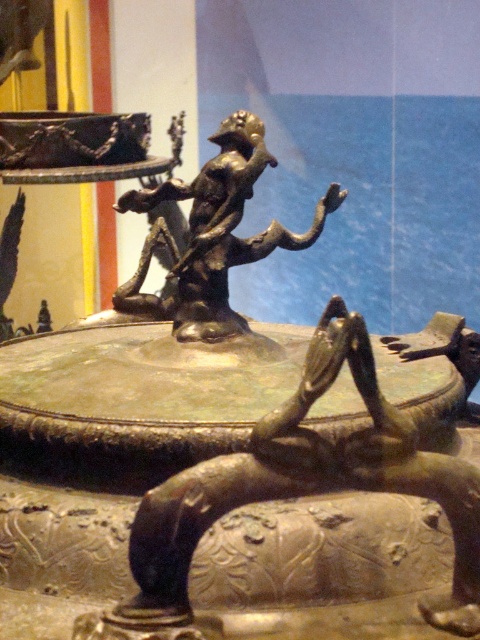
Question: Does bronze statue at center have a larger size compared to gold-bronze statue at center?

Choices:
 (A) no
 (B) yes

Answer: (A)

Question: Which object is closer to the camera taking this photo?

Choices:
 (A) bronze statue at center
 (B) gold-bronze statue at center

Answer: (A)

Question: Is bronze statue at center above gold-bronze statue at center?

Choices:
 (A) yes
 (B) no

Answer: (B)

Question: Can you confirm if bronze statue at center is positioned to the left of gold-bronze statue at center?

Choices:
 (A) no
 (B) yes

Answer: (A)